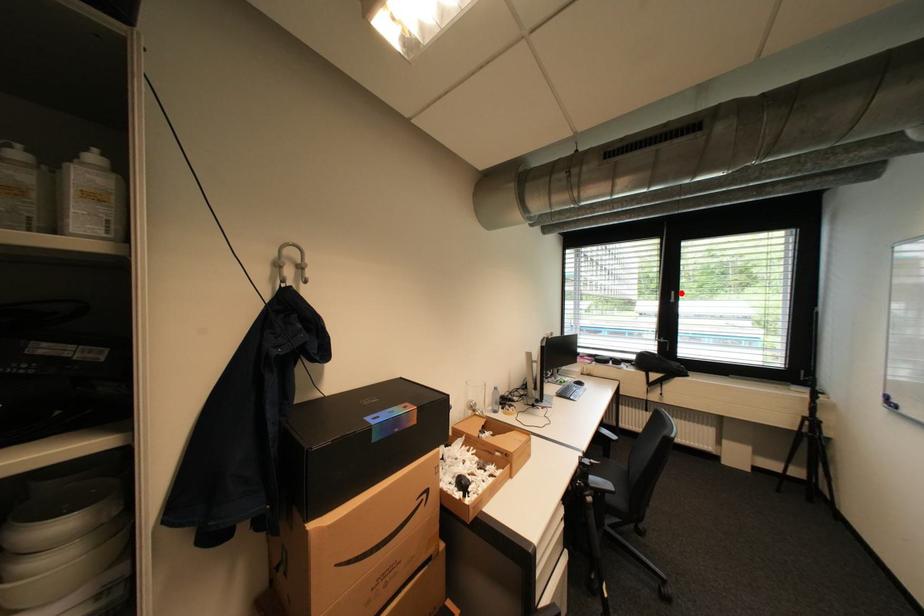
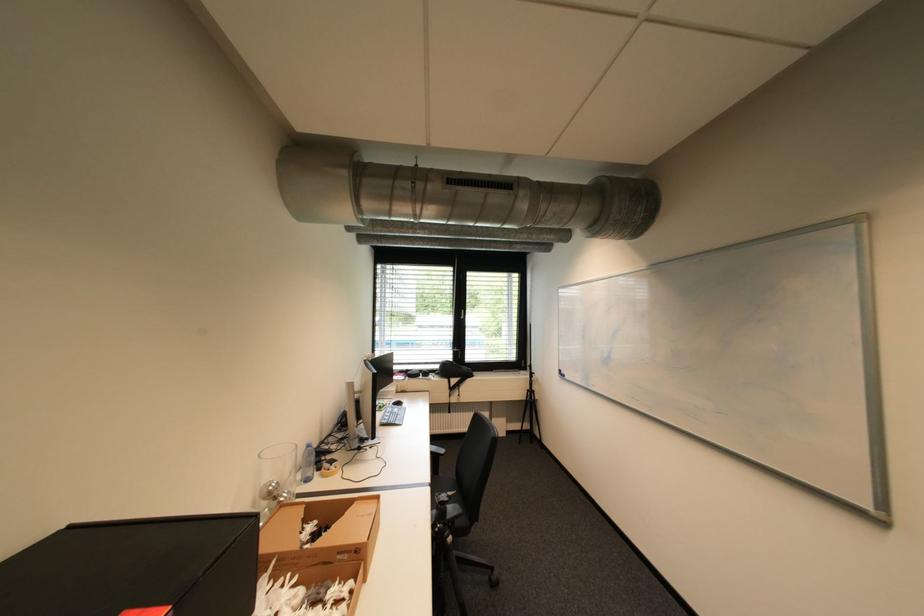
Question: I am providing you with two images of the same scene from different viewpoints. A red point is marked on the first image. Can you still see the location of the red point in image 2?

Choices:
 (A) Yes
 (B) No

Answer: (A)